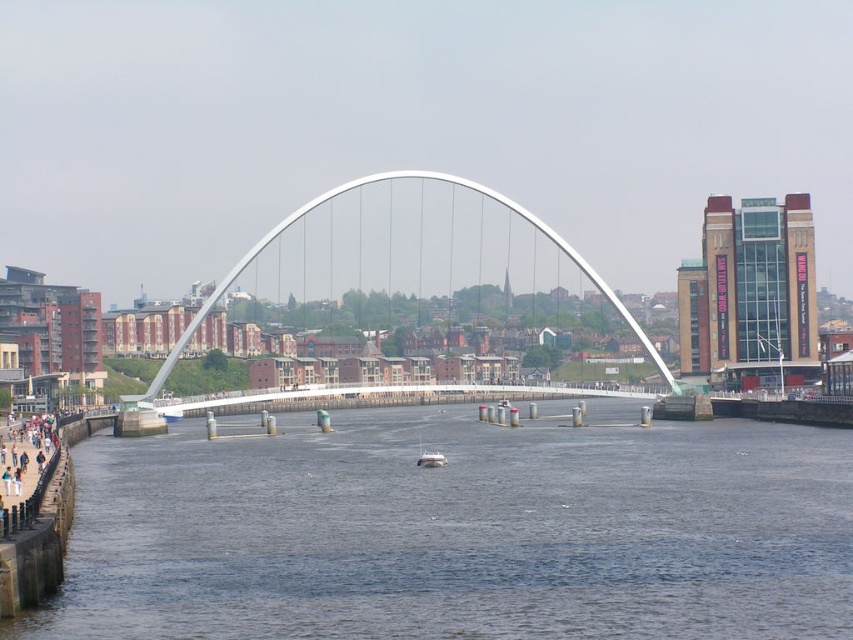
Question: Which point is farther to the camera?

Choices:
 (A) click(x=471, y=180)
 (B) click(x=506, y=499)

Answer: (A)

Question: Is dark blue water at center closer to the viewer compared to white metallic arch bridge at center?

Choices:
 (A) yes
 (B) no

Answer: (A)

Question: Does dark blue water at center have a greater width compared to white metallic arch bridge at center?

Choices:
 (A) yes
 (B) no

Answer: (B)

Question: In this image, where is dark blue water at center located relative to white metallic arch bridge at center?

Choices:
 (A) below
 (B) above

Answer: (A)

Question: Which point is farther to the camera?

Choices:
 (A) (740, 618)
 (B) (659, 358)

Answer: (B)